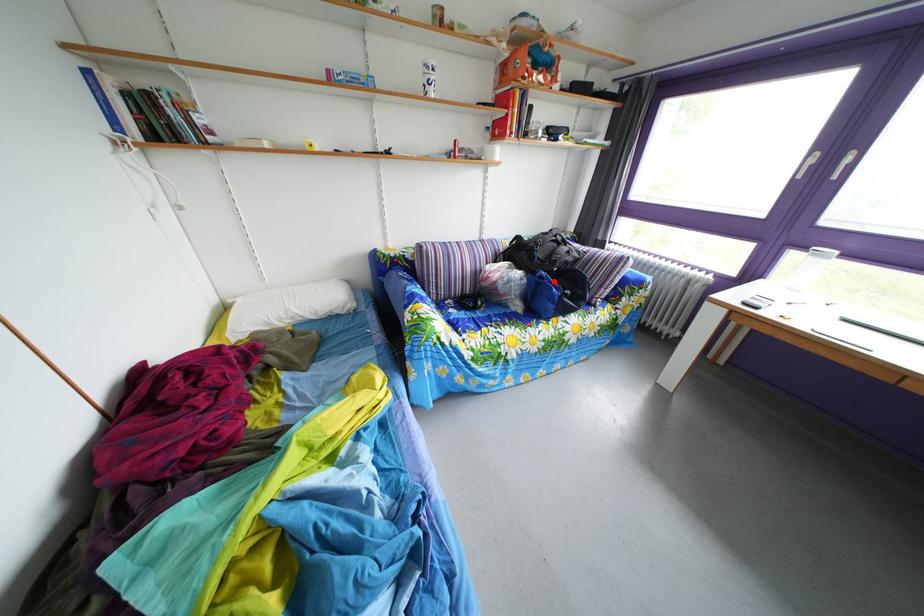
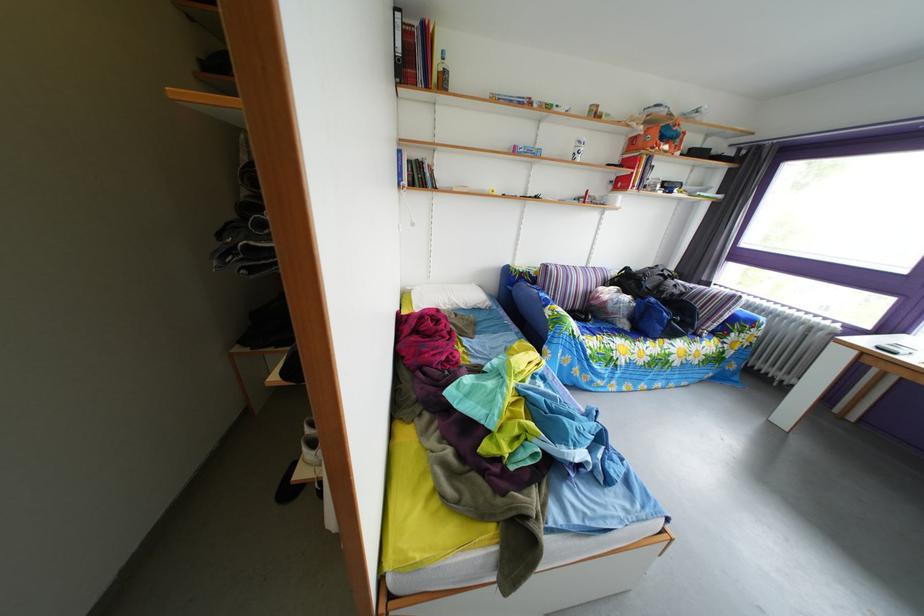
In the second image, find the point that corresponds to the highlighted location in the first image.

(663, 307)